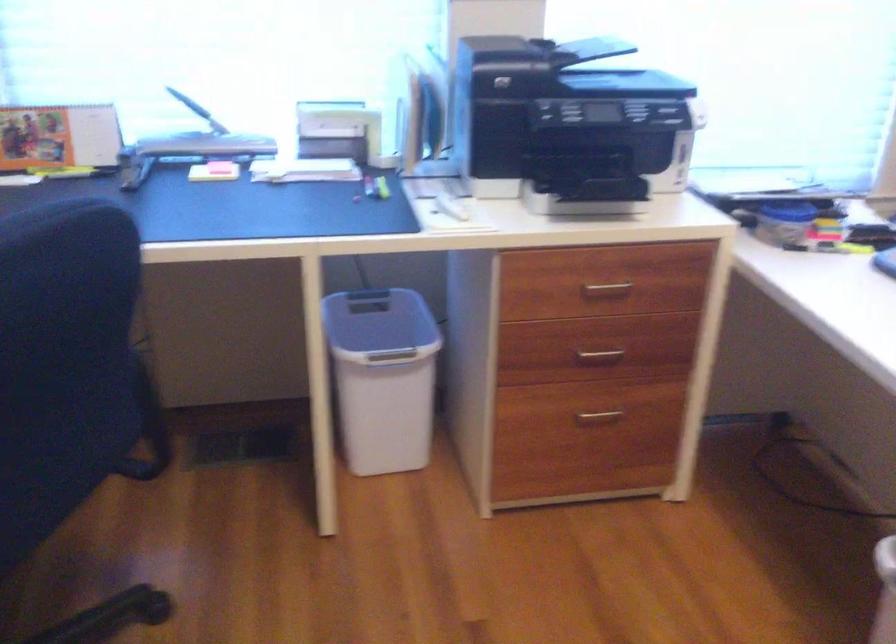
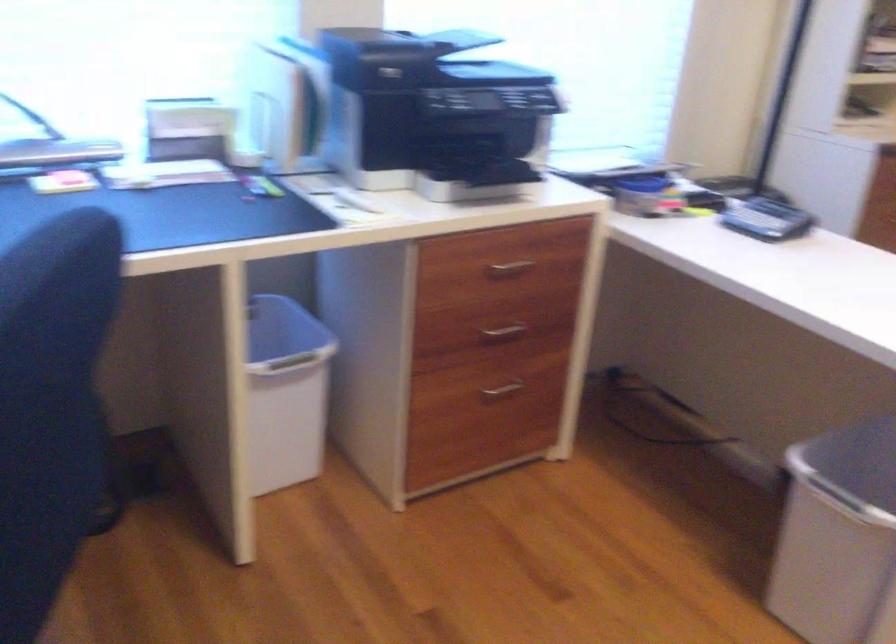
In the second image, find the point that corresponds to (598,412) in the first image.

(501, 388)